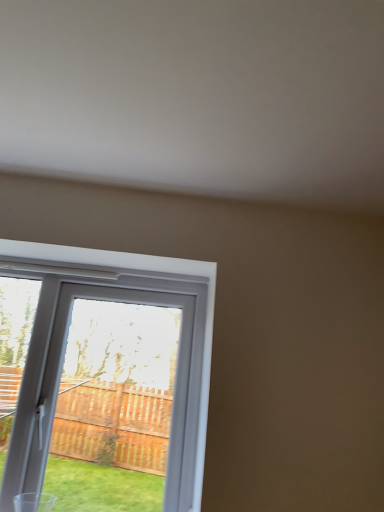
This screenshot has width=384, height=512. What do you see at coordinates (65, 352) in the screenshot? I see `white plastic window at left` at bounding box center [65, 352].

The width and height of the screenshot is (384, 512). I want to click on white plastic window at left, so point(65,352).

This screenshot has height=512, width=384. I want to click on white plastic window at left, so click(x=65, y=352).